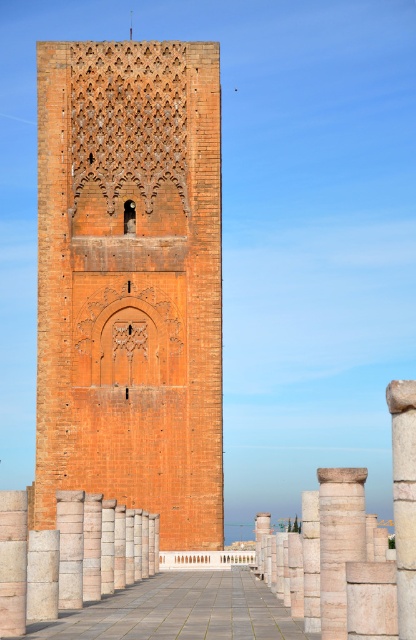
Is smooth stone pillar at left above smooth stone pillar at center?

Indeed, smooth stone pillar at left is positioned over smooth stone pillar at center.

Between smooth stone pillar at left and smooth stone pillar at center, which one has less height?

smooth stone pillar at center

Is point (7, 611) in front of point (76, 532)?

Yes, point (7, 611) is in front of point (76, 532).

The width and height of the screenshot is (416, 640). I want to click on smooth stone pillar at left, so click(12, 563).

Is white stone column at center thinner than smooth stone pillar at left?

In fact, white stone column at center might be wider than smooth stone pillar at left.

Which of these two, white stone column at center or smooth stone pillar at left, stands shorter?

With less height is smooth stone pillar at left.

You are a GUI agent. You are given a task and a screenshot of the screen. Output one action in this format:
    pyautogui.click(x=<x>, y=<y>)
    Task: Click on the white stone column at center
    This screenshot has height=640, width=416.
    Given the screenshot: What is the action you would take?
    pyautogui.click(x=403, y=499)

Does white stone column at center have a greater height compared to smooth stone pillar at center?

Indeed, white stone column at center has a greater height compared to smooth stone pillar at center.

Is point (411, 488) farther from camera compared to point (78, 513)?

No, it is in front of (78, 513).

Image resolution: width=416 pixels, height=640 pixels. What are the coordinates of `white stone column at center` in the screenshot? It's located at (403, 499).